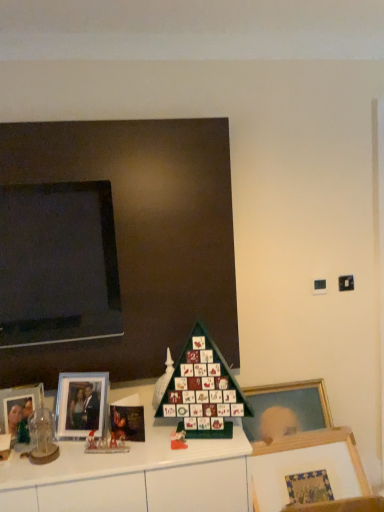
This screenshot has width=384, height=512. Find the location of `free space behind clear glass dome at left, which appears as the 1th toy when viewed from the front`. free space behind clear glass dome at left, which appears as the 1th toy when viewed from the front is located at coordinates (48, 441).